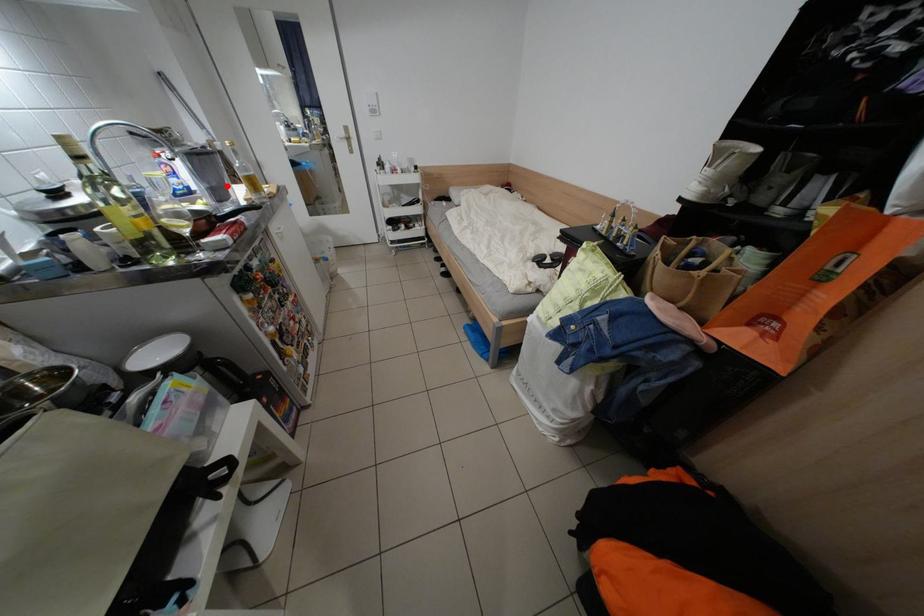
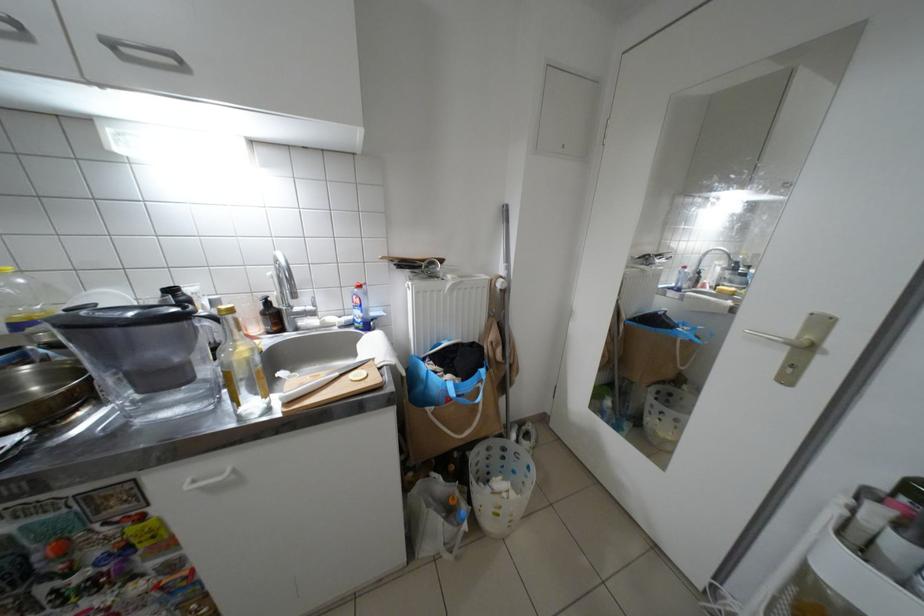
In the second image, find the point that corresponds to the highlighted location in the first image.

(139, 369)